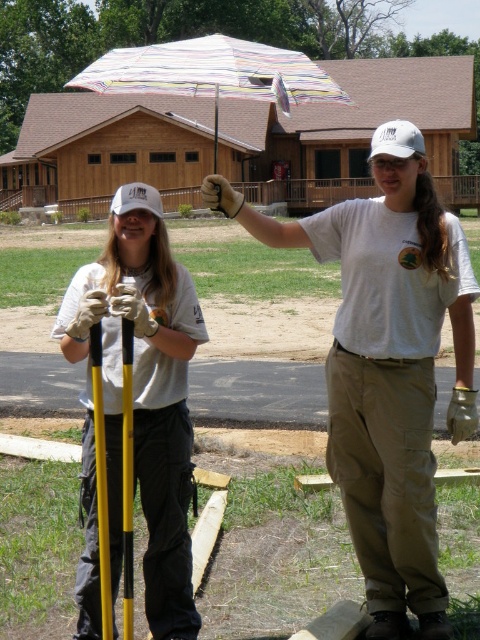
Based on the photo, which of these two, white cotton shirt at center or yellow matte pole at center, stands shorter?

white cotton shirt at center is shorter.

Can you confirm if white cotton shirt at center is taller than yellow matte pole at center?

Incorrect, white cotton shirt at center's height is not larger of yellow matte pole at center's.

Who is more distant from viewer, (410,392) or (108,614)?

Positioned behind is point (410,392).

At what (x,y) coordinates should I click in order to perform the action: click on white cotton shirt at center. Please return your answer as a coordinate pair (x, y). This screenshot has height=640, width=480. Looking at the image, I should click on (391, 378).

Can you confirm if yellow plastic pole at center is positioned below white matte baseball cap at upper left?

Indeed, yellow plastic pole at center is positioned under white matte baseball cap at upper left.

Which is above, yellow plastic pole at center or white matte baseball cap at upper left?

white matte baseball cap at upper left is higher up.

Which is in front, point (131, 365) or point (159, 218)?

Point (131, 365) is more forward.

Locate an element on the screen. The height and width of the screenshot is (640, 480). yellow plastic pole at center is located at coordinates (128, 476).

Does striped fabric umbrella at upper center have a lesser width compared to brown leather glove at upper center?

No, striped fabric umbrella at upper center is not thinner than brown leather glove at upper center.

I want to click on striped fabric umbrella at upper center, so click(212, 74).

You are a GUI agent. You are given a task and a screenshot of the screen. Output one action in this format:
    pyautogui.click(x=<x>, y=<y>)
    Task: Click on the striped fabric umbrella at upper center
    The height and width of the screenshot is (640, 480).
    Given the screenshot: What is the action you would take?
    pyautogui.click(x=212, y=74)